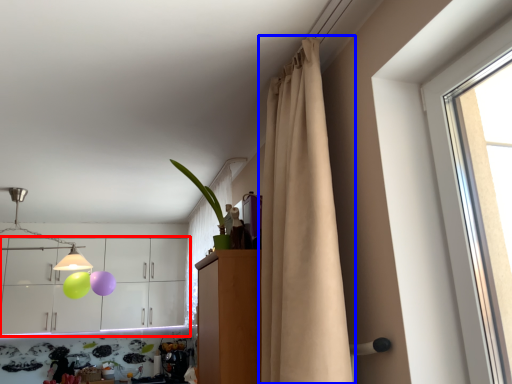
Question: Which point is further to the camera, cabinetry (highlighted by a red box) or curtain (highlighted by a blue box)?

Choices:
 (A) cabinetry
 (B) curtain

Answer: (A)